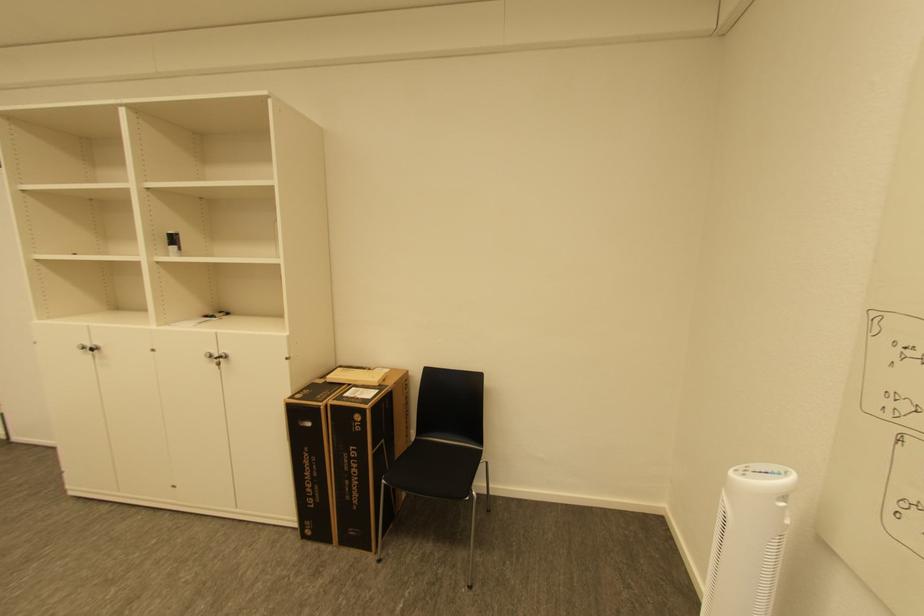
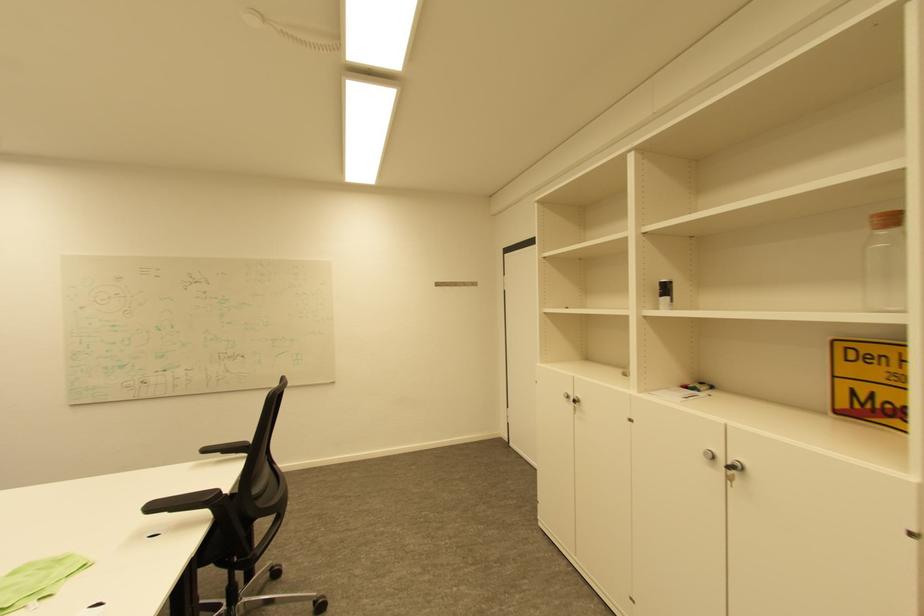
Find the pixel in the second image that matches [91,347] in the first image.

(574, 398)